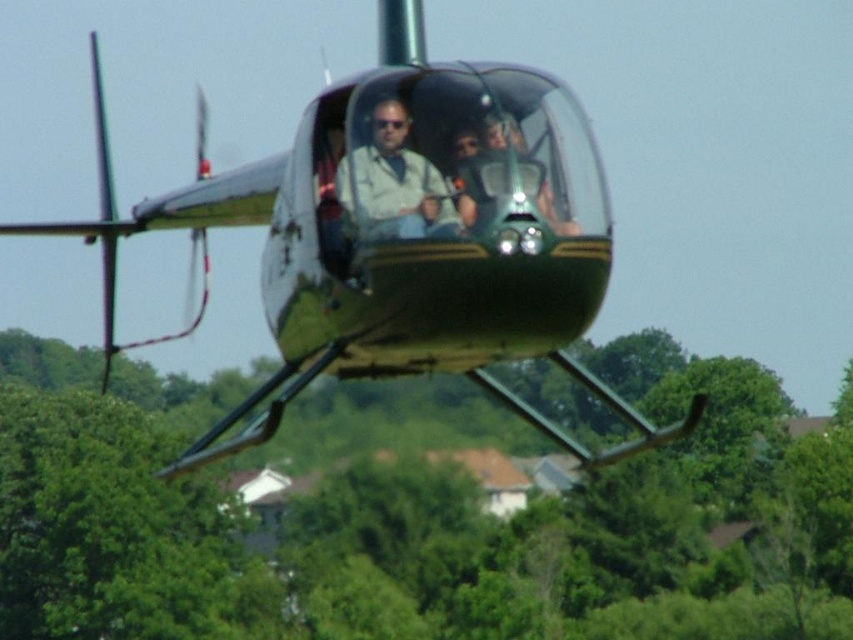
Question: Among these points, which one is farthest from the camera?

Choices:
 (A) (477, 376)
 (B) (373, 157)

Answer: (A)

Question: Which point is farther from the camera taking this photo?

Choices:
 (A) (62, 221)
 (B) (407, 150)

Answer: (A)

Question: In this image, where is metallic green helicopter at center located relative to matte beige shirt at center?

Choices:
 (A) left
 (B) right

Answer: (A)

Question: Does metallic green helicopter at center appear on the left side of matte beige shirt at center?

Choices:
 (A) yes
 (B) no

Answer: (A)

Question: Does metallic green helicopter at center have a lesser width compared to matte beige shirt at center?

Choices:
 (A) yes
 (B) no

Answer: (B)